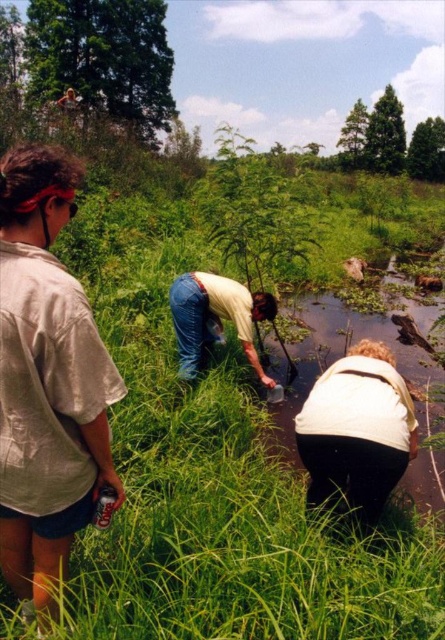
Is green grass at center taller than blue jeans at center?

Yes.

Is green grass at center to the right of blue jeans at center from the viewer's perspective?

In fact, green grass at center is to the left of blue jeans at center.

Which is in front, point (109, 580) or point (223, 307)?

Point (109, 580) is more forward.

Where is `green grass at center`? Image resolution: width=445 pixels, height=640 pixels. green grass at center is located at coordinates (164, 477).

Does point (41, 413) come farther from viewer compared to point (193, 364)?

No, it is in front of (193, 364).

You are a GUI agent. You are given a task and a screenshot of the screen. Output one action in this format:
    pyautogui.click(x=<x>, y=<y>)
    Task: Click on the white cotton shirt at left
    This screenshot has width=445, height=640.
    Given the screenshot: What is the action you would take?
    pyautogui.click(x=47, y=380)

Between white matte shirt at lower right and blue jeans at center, which one is positioned lower?

Positioned lower is white matte shirt at lower right.

Is white matte shirt at lower right wider than blue jeans at center?

Incorrect, white matte shirt at lower right's width does not surpass blue jeans at center's.

Find the location of a particular element. This screenshot has width=445, height=640. white matte shirt at lower right is located at coordinates (356, 429).

This screenshot has width=445, height=640. I want to click on white matte shirt at lower right, so click(356, 429).